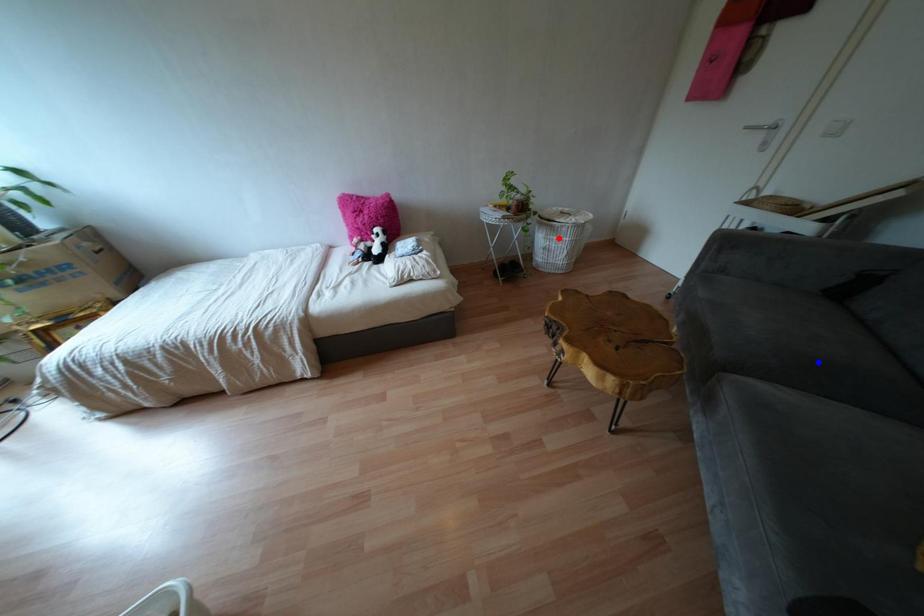
Question: Two points are marked on the image. Which point is closer to the camera?

Choices:
 (A) Blue point is closer.
 (B) Red point is closer.

Answer: (A)